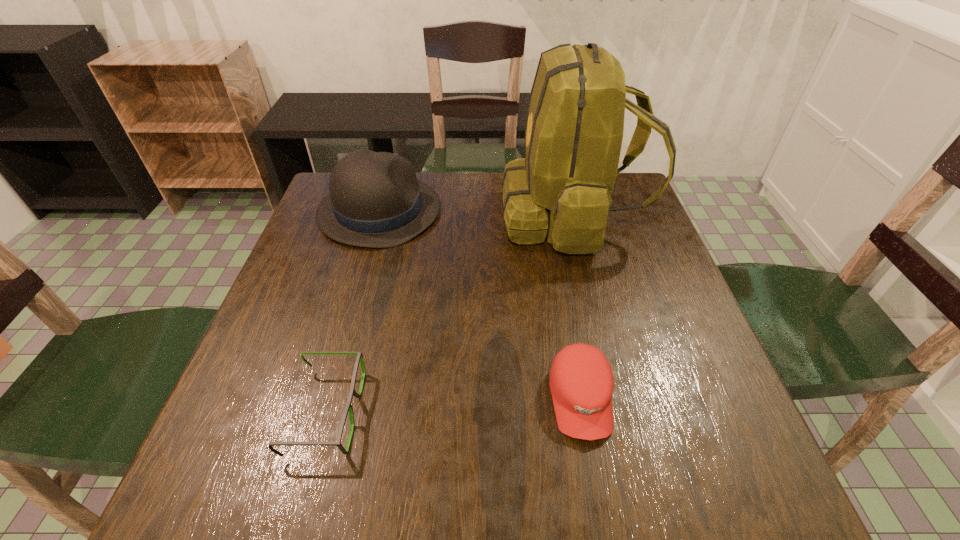
Find the location of a particular element. Image resolution: width=960 pixels, height=540 pixels. the tallest object is located at coordinates (562, 189).

Find the location of a particular element. The width and height of the screenshot is (960, 540). bowler hat is located at coordinates (375, 200).

Find the location of a particular element. This screenshot has height=540, width=960. the third tallest object is located at coordinates (581, 381).

Find the location of `spectacles`. spectacles is located at coordinates [348, 407].

This screenshot has width=960, height=540. In order to click on vacant area situated 0.050m on the front-facing side of the backpack in this screenshot , I will do `click(482, 215)`.

Locate an element on the screen. The height and width of the screenshot is (540, 960). free region located 0.290m on the front-facing side of the backpack is located at coordinates (395, 215).

I want to click on vacant region located on the front-facing side of the backpack, so tap(380, 215).

At what (x,y) coordinates should I click in order to perform the action: click on free region located 0.210m on the front-facing side of the bowler hat. Please return your answer as a coordinate pair (x, y). This screenshot has width=960, height=540. Looking at the image, I should click on (516, 211).

Locate an element on the screen. vacant region located 0.050m on the front-facing side of the cap is located at coordinates (594, 476).

The width and height of the screenshot is (960, 540). I want to click on blank space located 0.360m on the lens of the spectacles, so click(560, 412).